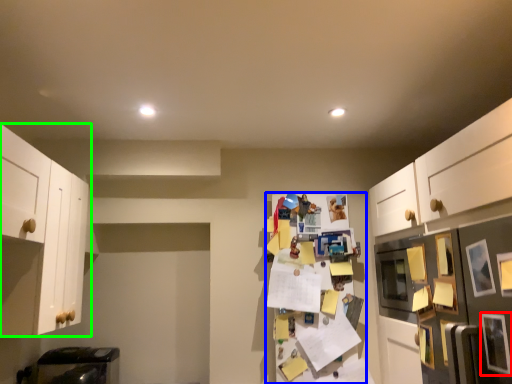
Question: Which is nearer to the picture frame (highlighted by a red box)? shelf (highlighted by a blue box) or cabinetry (highlighted by a green box).

Choices:
 (A) shelf
 (B) cabinetry

Answer: (A)